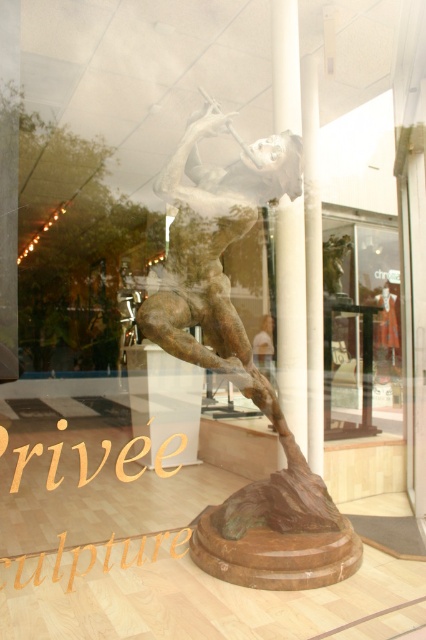
Question: Does bronze sculpture at center appear on the right side of clear glass display at center?

Choices:
 (A) yes
 (B) no

Answer: (B)

Question: Is bronze sculpture at center smaller than clear glass display at center?

Choices:
 (A) no
 (B) yes

Answer: (B)

Question: Does bronze sculpture at center come behind clear glass display at center?

Choices:
 (A) yes
 (B) no

Answer: (B)

Question: Which of the following is the farthest from the observer?

Choices:
 (A) bronze sculpture at center
 (B) clear glass display at center

Answer: (B)

Question: Which of the following is the closest to the observer?

Choices:
 (A) clear glass display at center
 (B) bronze sculpture at center

Answer: (B)